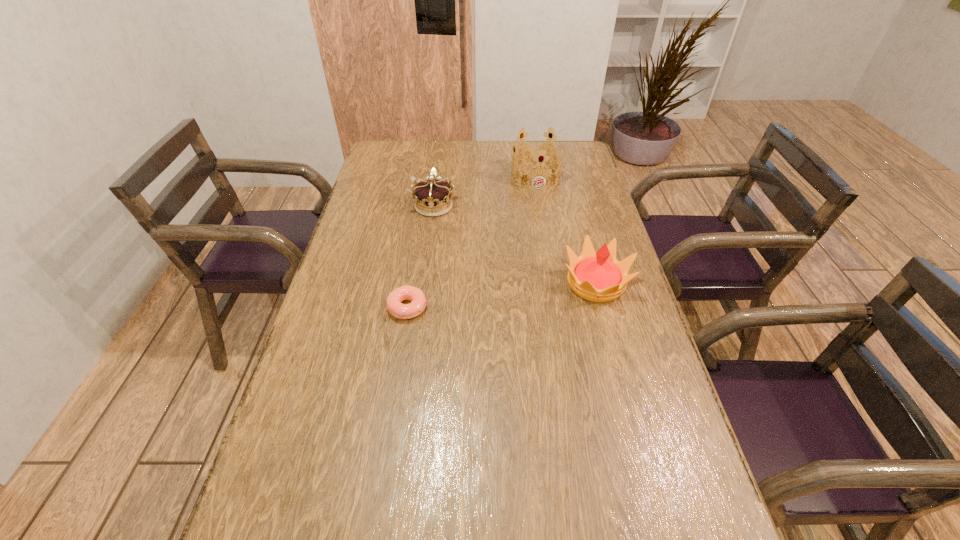
What are the coordinates of `the farthest crown` in the screenshot? It's located at (537, 151).

Locate an element on the screen. the nearest crown is located at coordinates 597,276.

Find the location of `the second farthest object`. the second farthest object is located at coordinates (430, 196).

The width and height of the screenshot is (960, 540). I want to click on the second shortest object, so click(430, 196).

Identify the location of the shortest object. (411, 310).

The height and width of the screenshot is (540, 960). Find the location of `free point located on the left of the farthest object`. free point located on the left of the farthest object is located at coordinates (465, 177).

This screenshot has width=960, height=540. I want to click on vacant space located 0.070m on the back of the nearest crown, so click(586, 245).

I want to click on blank area located 0.120m on the left of the third nearest object, so click(377, 206).

At what (x,y) coordinates should I click in order to perform the action: click on free space located 0.280m on the front of the shortest object. Please return your answer as a coordinate pair (x, y). Image resolution: width=960 pixels, height=540 pixels. Looking at the image, I should click on (390, 419).

Where is `object situated at the far edge`? The height and width of the screenshot is (540, 960). object situated at the far edge is located at coordinates (537, 151).